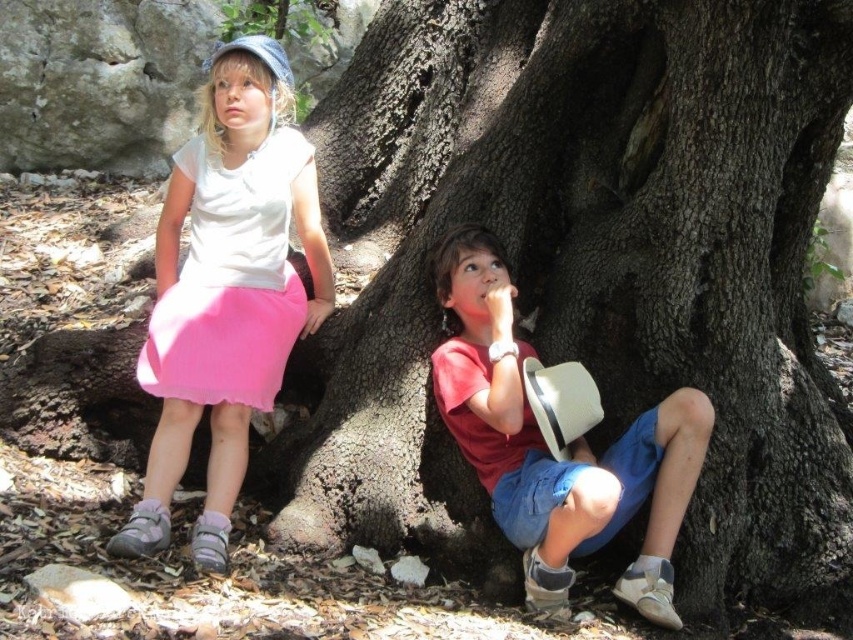
Looking at this image, you are a photographer trying to capture a photo of the rough bark tree at center and the matte pink skirt at left. Based on their positions, which object is located to the right of the other?

The rough bark tree at center is positioned on the right side of matte pink skirt at left, so the rough bark tree at center is to the right of the matte pink skirt at left.

You are a photographer trying to capture a clear shot of both the matte pink skirt at left and the matte red shirt at center. Which object is closer to the camera, and will it block the view of the other?

The matte pink skirt at left is closer to the camera than the matte red shirt at center. This means the matte pink skirt at left may block part of the view of the matte red shirt at center depending on their positions.

You are a photographer trying to capture a photo of the two children under the rough bark tree at center. To ensure the tree is perfectly centered in the frame, where should you position the camera relative to the tree?

The rough bark tree at center is already positioned at point (589,269), so to center it in the frame, the camera should be aligned so the tree is at the center coordinates of the image, which is typically at (426,320). Adjust the camera position slightly to the right and upward to move the tree closer to the center point.